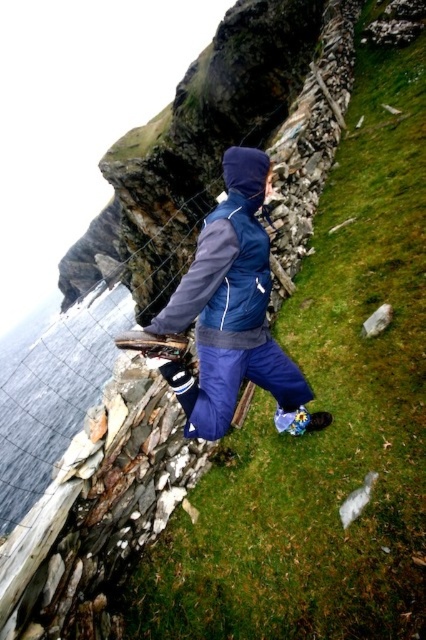
Between blue fabric jacket at center and transparent water at lower left, which one appears on the left side from the viewer's perspective?

transparent water at lower left

Is point (241, 349) in front of point (121, 307)?

Yes, point (241, 349) is in front of point (121, 307).

Where is `blue fabric jacket at center`? The width and height of the screenshot is (426, 640). blue fabric jacket at center is located at coordinates (232, 314).

Is transparent water at lower left taller than blue fleece jacket at center?

Correct, transparent water at lower left is much taller as blue fleece jacket at center.

Is point (3, 486) closer to camera compared to point (215, 252)?

No, it is not.

Is point (103, 296) closer to viewer compared to point (242, 324)?

No, (103, 296) is behind (242, 324).

I want to click on transparent water at lower left, so click(51, 394).

Which is above, blue fabric jacket at center or blue fleece jacket at center?

blue fleece jacket at center is higher up.

Which of these two, blue fabric jacket at center or blue fleece jacket at center, stands taller?

blue fabric jacket at center

Who is more forward, (296, 404) or (199, 273)?

Positioned in front is point (199, 273).

At what (x,y) coordinates should I click in order to perform the action: click on blue fabric jacket at center. Please return your answer as a coordinate pair (x, y). The width and height of the screenshot is (426, 640). Looking at the image, I should click on (232, 314).